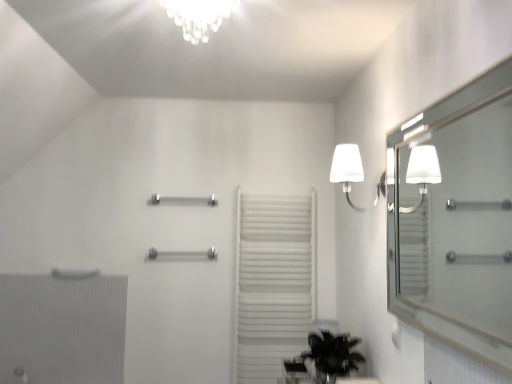
Question: Does white fabric lamp at upper right have a greater width compared to polished chrome towel bar at center, positioned as the 2th towel bar in bottom-to-top order?

Choices:
 (A) yes
 (B) no

Answer: (A)

Question: Can you confirm if white fabric lamp at upper right is taller than polished chrome towel bar at center, the first towel bar viewed from the top?

Choices:
 (A) no
 (B) yes

Answer: (B)

Question: Is white fabric lamp at upper right at the right side of polished chrome towel bar at center, the first towel bar viewed from the top?

Choices:
 (A) no
 (B) yes

Answer: (B)

Question: From the image's perspective, does white fabric lamp at upper right appear higher than polished chrome towel bar at center, the first towel bar viewed from the top?

Choices:
 (A) yes
 (B) no

Answer: (A)

Question: Considering the relative sizes of white fabric lamp at upper right and polished chrome towel bar at center, positioned as the 2th towel bar in bottom-to-top order, in the image provided, is white fabric lamp at upper right thinner than polished chrome towel bar at center, positioned as the 2th towel bar in bottom-to-top order,?

Choices:
 (A) no
 (B) yes

Answer: (A)

Question: Considering the positions of polished chrome towel bar at center, acting as the second towel bar starting from the top, and white textured radiator at lower left in the image, is polished chrome towel bar at center, acting as the second towel bar starting from the top, bigger or smaller than white textured radiator at lower left?

Choices:
 (A) small
 (B) big

Answer: (A)

Question: Is point (202, 253) closer or farther from the camera than point (108, 299)?

Choices:
 (A) closer
 (B) farther

Answer: (B)

Question: Is polished chrome towel bar at center, arranged as the 1th towel bar when ordered from the bottom, inside the boundaries of white textured radiator at lower left, or outside?

Choices:
 (A) outside
 (B) inside

Answer: (A)

Question: Looking at their shapes, would you say polished chrome towel bar at center, acting as the second towel bar starting from the top, is wider or thinner than white textured radiator at lower left?

Choices:
 (A) wide
 (B) thin

Answer: (A)

Question: In the image, is polished chrome towel bar at center, positioned as the 2th towel bar in bottom-to-top order, on the left side or the right side of polished chrome towel bar at center, arranged as the 1th towel bar when ordered from the bottom?

Choices:
 (A) right
 (B) left

Answer: (A)

Question: Which is correct: polished chrome towel bar at center, positioned as the 2th towel bar in bottom-to-top order, is inside polished chrome towel bar at center, acting as the second towel bar starting from the top, or outside of it?

Choices:
 (A) outside
 (B) inside

Answer: (A)

Question: In the image, is polished chrome towel bar at center, the first towel bar viewed from the top, positioned in front of or behind polished chrome towel bar at center, arranged as the 1th towel bar when ordered from the bottom?

Choices:
 (A) behind
 (B) front

Answer: (A)

Question: From a real-world perspective, is polished chrome towel bar at center, the first towel bar viewed from the top, physically located above or below polished chrome towel bar at center, acting as the second towel bar starting from the top?

Choices:
 (A) above
 (B) below

Answer: (A)

Question: From the image's perspective, is white matte towel rack at center above or below polished chrome towel bar at center, acting as the second towel bar starting from the top?

Choices:
 (A) below
 (B) above

Answer: (A)

Question: From a real-world perspective, is white matte towel rack at center physically located above or below polished chrome towel bar at center, acting as the second towel bar starting from the top?

Choices:
 (A) below
 (B) above

Answer: (A)